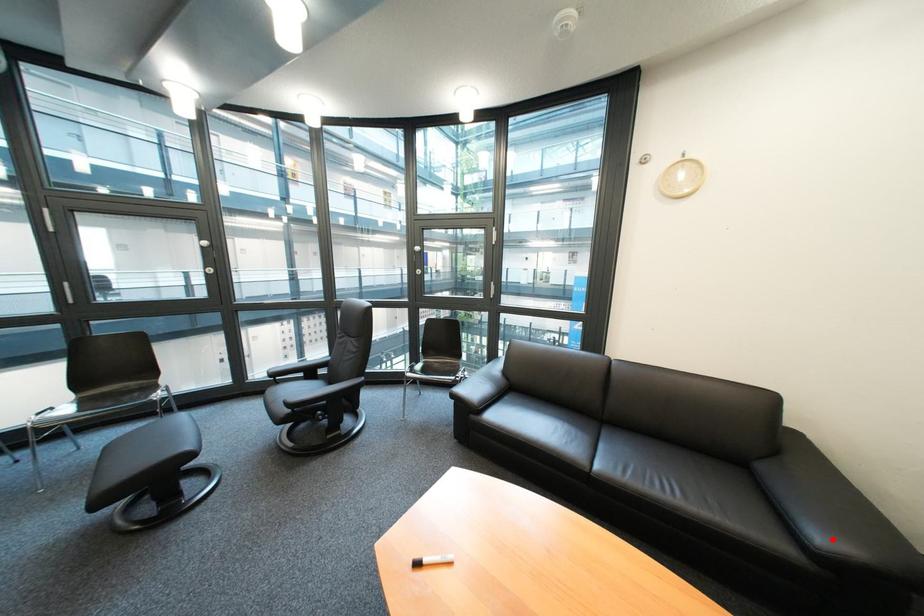
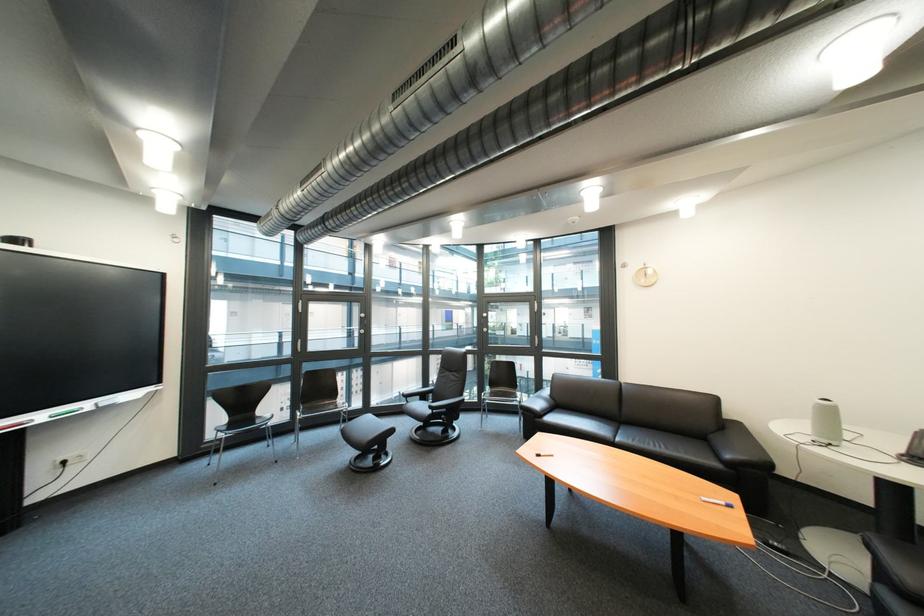
Question: I am providing you with two images of the same scene from different viewpoints. Image1 has a red point marked. In image2, the corresponding 3D location appears at what relative position? Reply with the corresponding letter.

Choices:
 (A) Closer
 (B) Farther

Answer: (B)